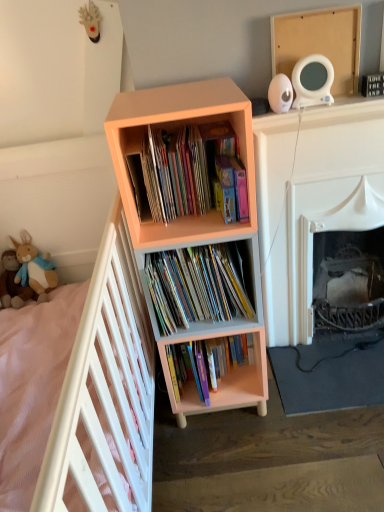
Question: Which direction should I rotate to look at matte pink bookshelf at center, positioned as the first book in top-to-bottom order, — up or down?

Choices:
 (A) up
 (B) down

Answer: (A)

Question: Is white wooden bed at left directly adjacent to hardcover books at center, the 3th book viewed from the top?

Choices:
 (A) no
 (B) yes

Answer: (A)

Question: Could you tell me if white wooden bed at left is facing hardcover books at center, the 3th book viewed from the top?

Choices:
 (A) yes
 (B) no

Answer: (A)

Question: Can you confirm if white wooden bed at left is shorter than hardcover books at center, the 3th book viewed from the top?

Choices:
 (A) no
 (B) yes

Answer: (A)

Question: Does white wooden bed at left have a smaller size compared to hardcover books at center, the 3th book viewed from the top?

Choices:
 (A) no
 (B) yes

Answer: (A)

Question: Would you say hardcover books at center, the 3th book viewed from the top, is part of white wooden bed at left's contents?

Choices:
 (A) yes
 (B) no

Answer: (B)

Question: Would you consider white wooden bed at left to be distant from hardcover books at center, the 3th book viewed from the top?

Choices:
 (A) no
 (B) yes

Answer: (A)

Question: Considering the relative positions of soft plush toy at left, the first toy positioned from the left, and white wooden bed at left in the image provided, is soft plush toy at left, the first toy positioned from the left, to the left of white wooden bed at left from the viewer's perspective?

Choices:
 (A) no
 (B) yes

Answer: (B)

Question: From a real-world perspective, is soft plush toy at left, marked as the second toy in a right-to-left arrangement, on white wooden bed at left?

Choices:
 (A) yes
 (B) no

Answer: (A)

Question: From the image's perspective, is soft plush toy at left, the first toy positioned from the left, under white wooden bed at left?

Choices:
 (A) yes
 (B) no

Answer: (B)

Question: Considering the relative sizes of soft plush toy at left, the first toy positioned from the left, and white wooden bed at left in the image provided, is soft plush toy at left, the first toy positioned from the left, wider than white wooden bed at left?

Choices:
 (A) yes
 (B) no

Answer: (B)

Question: Does soft plush toy at left, marked as the second toy in a right-to-left arrangement, have a smaller size compared to white wooden bed at left?

Choices:
 (A) yes
 (B) no

Answer: (A)

Question: Considering the relative positions of soft plush toy at left, the first toy positioned from the left, and white wooden bed at left in the image provided, is soft plush toy at left, the first toy positioned from the left, behind white wooden bed at left?

Choices:
 (A) no
 (B) yes

Answer: (B)

Question: Considering the relative positions of white wooden bed at left and matte cardboard books at center, which is the 2th book in bottom-to-top order, in the image provided, is white wooden bed at left to the left of matte cardboard books at center, which is the 2th book in bottom-to-top order, from the viewer's perspective?

Choices:
 (A) yes
 (B) no

Answer: (A)